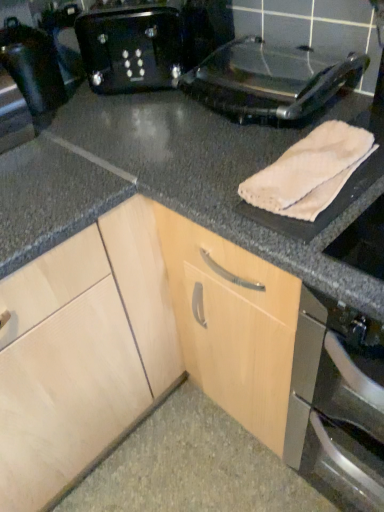
Question: Considering the positions of beige soft towel at upper right and shiny black toaster at left in the image, is beige soft towel at upper right taller or shorter than shiny black toaster at left?

Choices:
 (A) tall
 (B) short

Answer: (B)

Question: Considering their positions, is beige soft towel at upper right located in front of or behind shiny black toaster at left?

Choices:
 (A) behind
 (B) front

Answer: (B)

Question: Estimate the real-world distances between objects in this image. Which object is closer to the shiny black toaster at left?

Choices:
 (A) beige soft towel at upper right
 (B) white fabric towel at right
 (C) black plastic toaster at upper center
 (D) metallic black toaster at upper right

Answer: (C)

Question: Based on their relative distances, which object is nearer to the shiny black toaster at left?

Choices:
 (A) metallic black toaster at upper right
 (B) white fabric towel at right
 (C) black plastic toaster at upper center
 (D) beige soft towel at upper right

Answer: (C)